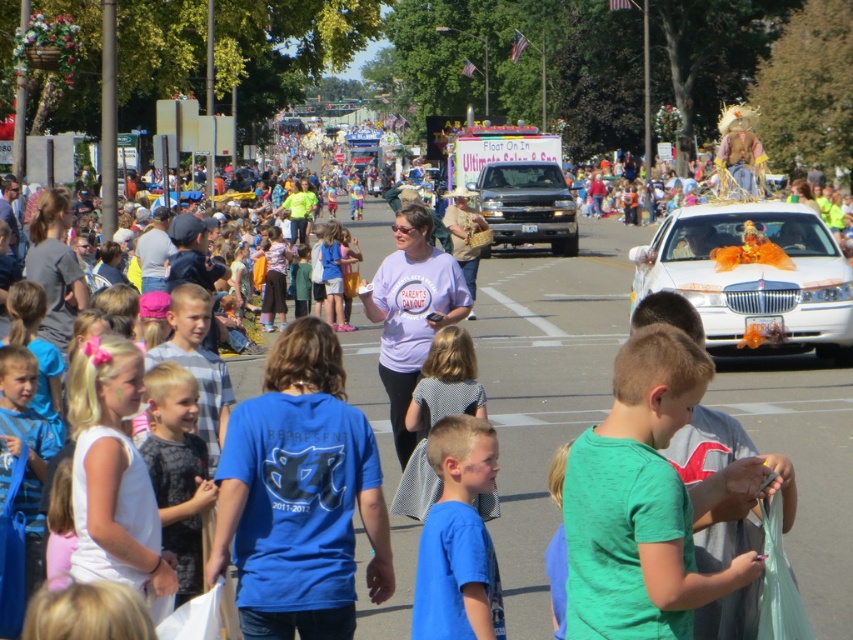
Does point (846, 332) lie in front of point (440, 406)?

No, (846, 332) is behind (440, 406).

Describe the element at coordinates (753, 276) in the screenshot. Image resolution: width=853 pixels, height=640 pixels. I see `white glossy sedan at center` at that location.

Find the location of a particular element. The height and width of the screenshot is (640, 853). white glossy sedan at center is located at coordinates (753, 276).

Between point (787, 273) and point (186, 390), which one is positioned in front?

Point (186, 390)

Measure the distance from white glossy sedan at center to dark gray printed shirt at center.

white glossy sedan at center is 12.28 meters away from dark gray printed shirt at center.

This screenshot has height=640, width=853. Identify the location of white glossy sedan at center. (753, 276).

Who is higher up, dark gray printed shirt at center or blue t-shirt at center?

Positioned higher is blue t-shirt at center.

Which is behind, point (161, 401) or point (421, 456)?

Positioned behind is point (421, 456).

Which is in front, point (165, 376) or point (397, 506)?

Positioned in front is point (165, 376).

Identify the location of dark gray printed shirt at center. The height and width of the screenshot is (640, 853). (177, 468).